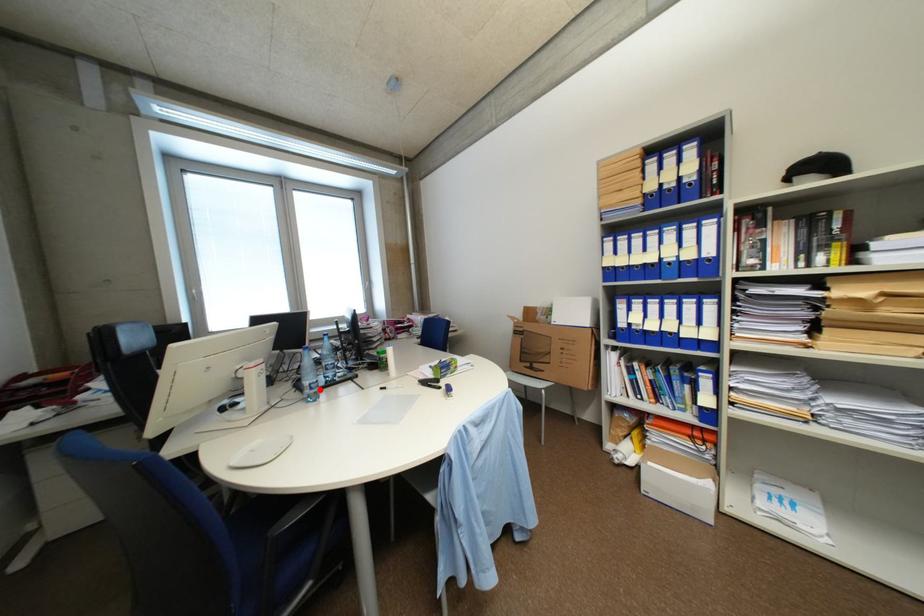
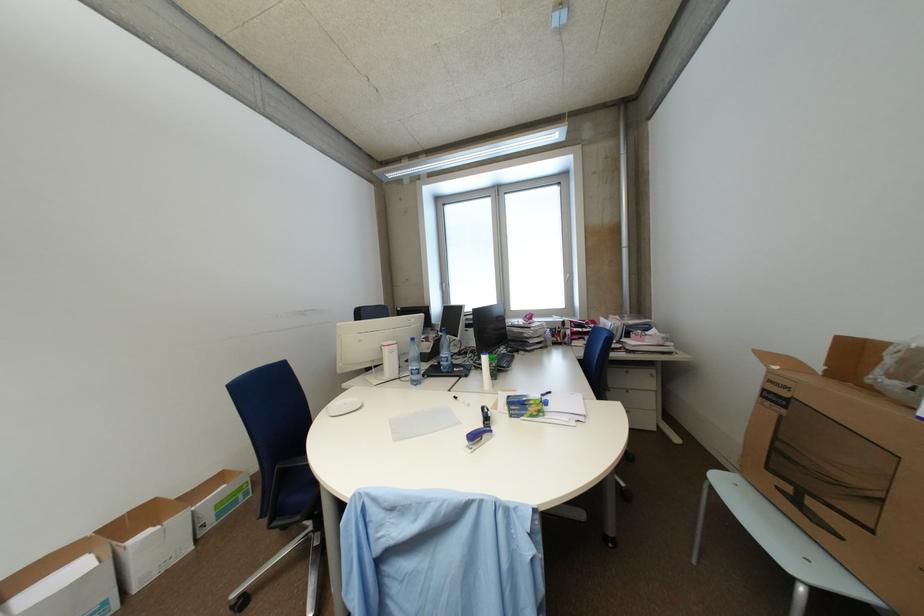
Find the pixel in the second image that matches the highlighted location in the first image.

(420, 375)